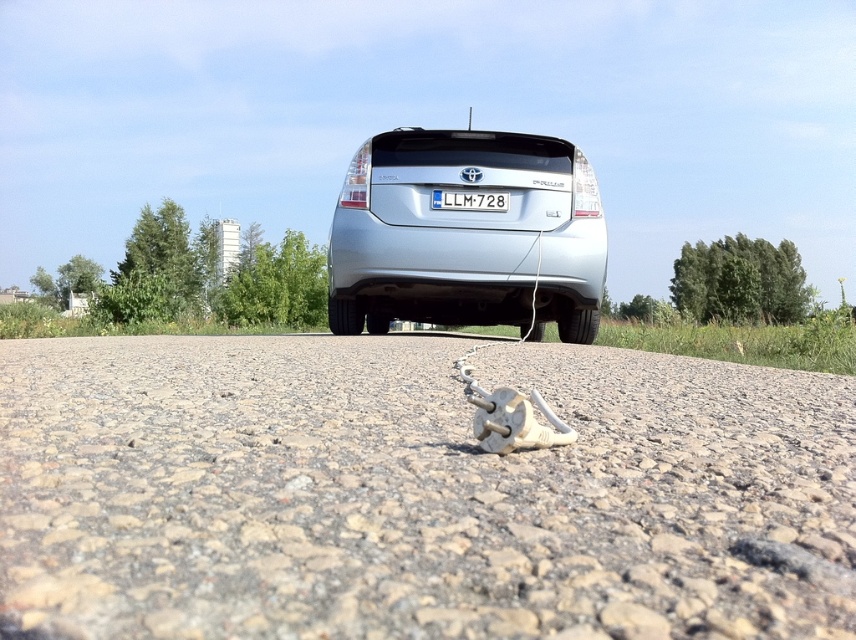
Which of these two, gray gravel at center or silver metallic car at center, stands taller?

silver metallic car at center is taller.

Can you confirm if gray gravel at center is positioned above silver metallic car at center?

Actually, gray gravel at center is below silver metallic car at center.

Which is behind, point (58, 387) or point (474, 168)?

The point (474, 168) is behind.

Find the location of a particular element. The width and height of the screenshot is (856, 640). gray gravel at center is located at coordinates (415, 492).

Looking at this image, is silver metallic car at center bigger than white plastic license plate at center?

Yes, silver metallic car at center is bigger than white plastic license plate at center.

Between point (349, 310) and point (500, 202), which one is positioned in front?

Point (500, 202)

Identify the location of silver metallic car at center. (467, 236).

Does gray gravel at center appear on the right side of white plastic license plate at center?

Incorrect, gray gravel at center is not on the right side of white plastic license plate at center.

Who is positioned more to the left, gray gravel at center or white plastic license plate at center?

gray gravel at center

What do you see at coordinates (415, 492) in the screenshot? I see `gray gravel at center` at bounding box center [415, 492].

I want to click on gray gravel at center, so click(415, 492).